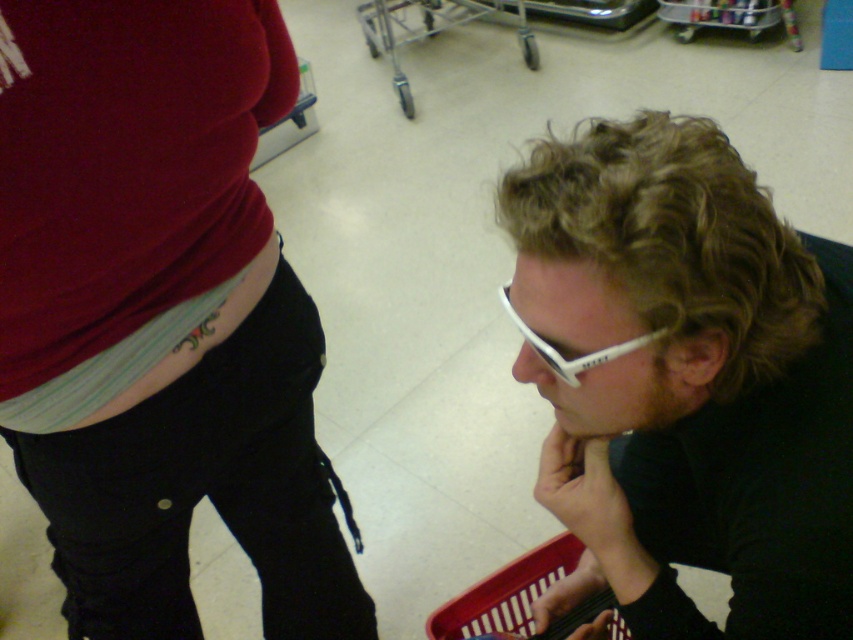
Is point (546, 563) positioned after point (422, 1)?

No, it is not.

The image size is (853, 640). Identify the location of red plastic basket at lower right. (506, 593).

Who is lower down, metallic silver shopping cart at upper center or white matte goggles at lower right?

white matte goggles at lower right is lower down.

Between point (376, 16) and point (631, 340), which one is positioned in front?

Positioned in front is point (631, 340).

This screenshot has width=853, height=640. What are the coordinates of `metallic silver shopping cart at upper center` in the screenshot? It's located at (433, 29).

Between matte black pants at lower left and metallic silver shopping cart at upper center, which one appears on the right side from the viewer's perspective?

metallic silver shopping cart at upper center is more to the right.

Can you confirm if matte black pants at lower left is thinner than metallic silver shopping cart at upper center?

Indeed, matte black pants at lower left has a lesser width compared to metallic silver shopping cart at upper center.

Which is behind, point (50, 125) or point (523, 13)?

The point (523, 13) is behind.

Locate an element on the screen. matte black pants at lower left is located at coordinates (160, 314).